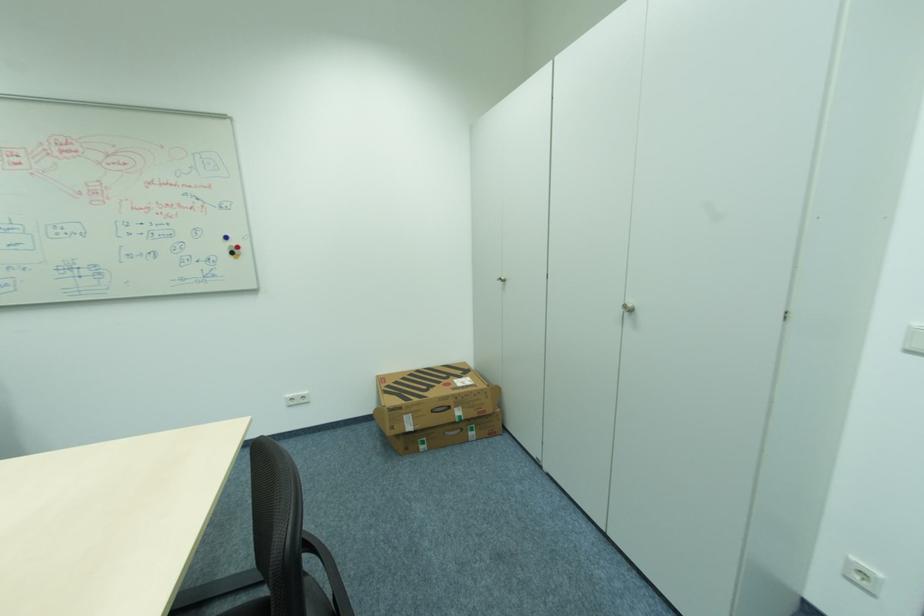
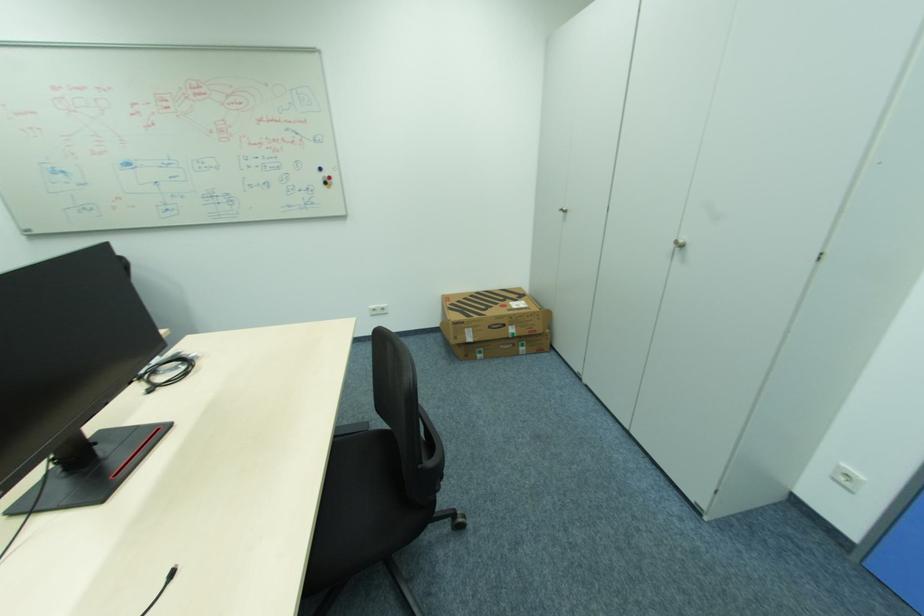
In the second image, find the point that corresponds to the point at 631,306 in the first image.

(679, 243)